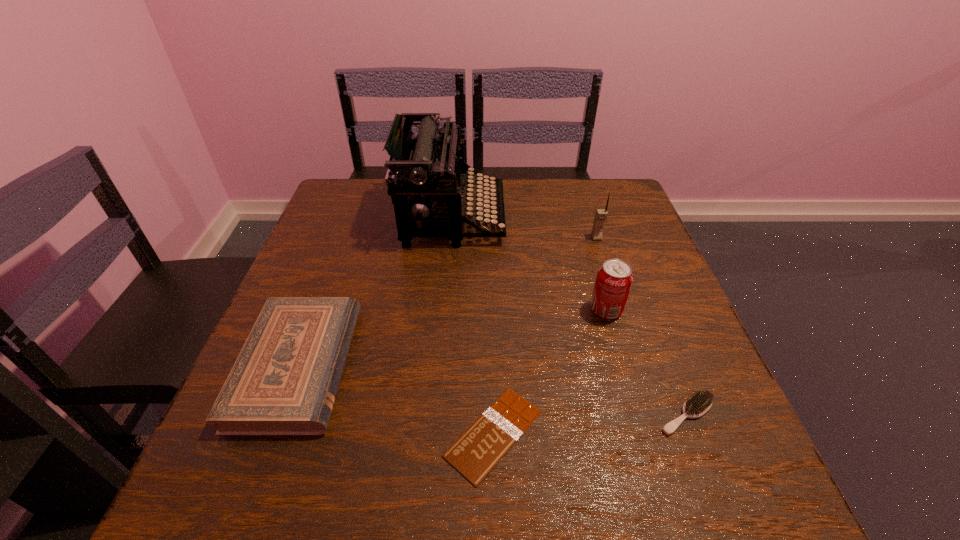
Identify the location of free space between the scrubbing brush and the tallest object. (569, 315).

Find the location of `object that stands as the third closest to the soda`. object that stands as the third closest to the soda is located at coordinates (601, 214).

Find the location of a particular element. the fourth closest object to the cellular telephone is located at coordinates (476, 452).

This screenshot has width=960, height=540. What are the coordinates of `vacant space that satisfies the following two spatial constraints: 1. on the typing side of the typewriter; 2. on the back side of the soda` in the screenshot? It's located at (445, 310).

Identify the location of vacant space that satisfies the following two spatial constraints: 1. on the typing side of the chocolate bar; 2. on the right side of the typewriter. (435, 434).

Locate an element on the screen. This screenshot has width=960, height=540. vacant space that satisfies the following two spatial constraints: 1. on the typing side of the second shortest object; 2. on the left side of the typewriter is located at coordinates (437, 415).

This screenshot has width=960, height=540. What are the coordinates of `vacant space that satisfies the following two spatial constraints: 1. on the typing side of the typewriter; 2. on the left side of the second shortest object` in the screenshot? It's located at (437, 415).

The width and height of the screenshot is (960, 540). Find the location of `vacant area in the image that satisfies the following two spatial constraints: 1. on the typing side of the soda; 2. on the left side of the typewriter`. vacant area in the image that satisfies the following two spatial constraints: 1. on the typing side of the soda; 2. on the left side of the typewriter is located at coordinates (445, 310).

At what (x,y) coordinates should I click in order to perform the action: click on vacant space that satisfies the following two spatial constraints: 1. on the spine side of the Bible; 2. on the left side of the chocolate bar. Please return your answer as a coordinate pair (x, y). Image resolution: width=960 pixels, height=540 pixels. Looking at the image, I should click on (273, 434).

Locate an element on the screen. vacant space that satisfies the following two spatial constraints: 1. on the back side of the chocolate bar; 2. on the left side of the soda is located at coordinates (491, 310).